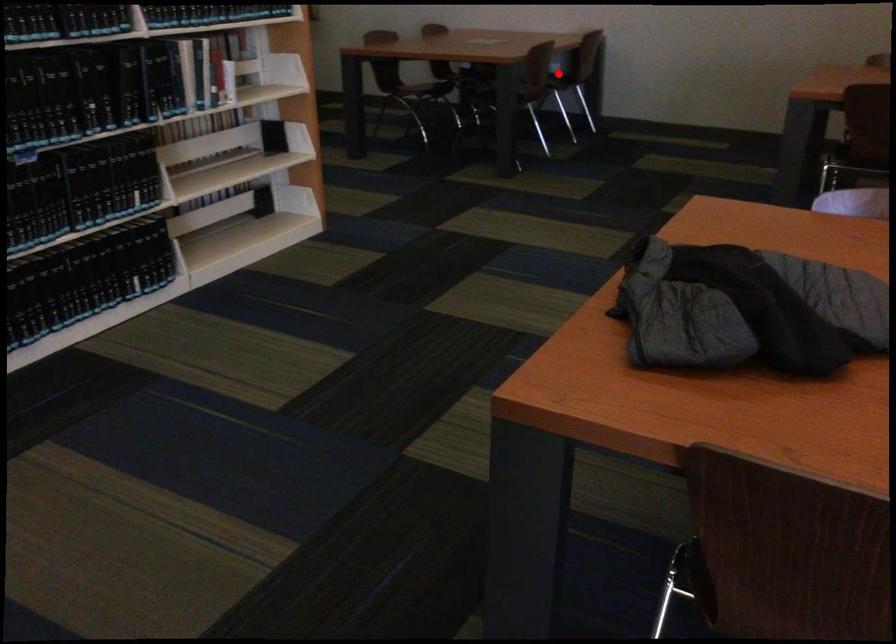
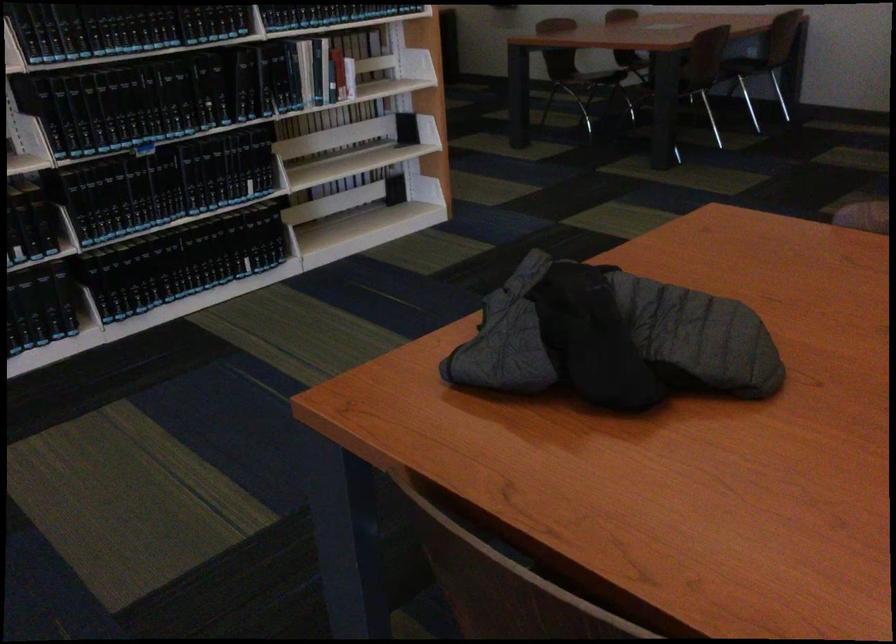
In the second image, find the point that corresponds to the highlighted location in the first image.

(743, 58)